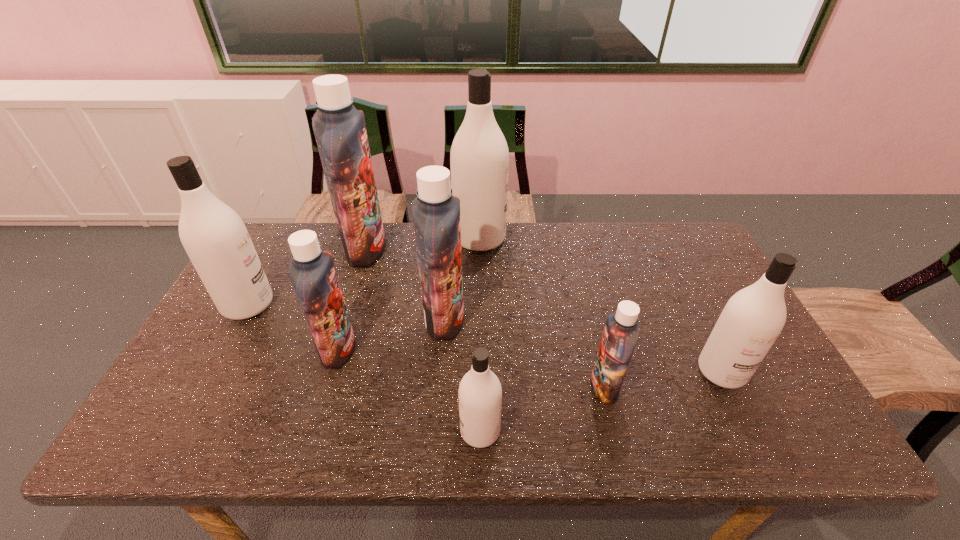
Where is `free space at the right edge`? The height and width of the screenshot is (540, 960). free space at the right edge is located at coordinates (708, 318).

You are a GUI agent. You are given a task and a screenshot of the screen. Output one action in this format:
    pyautogui.click(x=<x>, y=<y>)
    Task: Click on the blank space at the near right corner of the desktop
    This screenshot has height=540, width=960.
    Given the screenshot: What is the action you would take?
    pyautogui.click(x=748, y=420)

What are the coordinates of `empty space that is in between the leftmost object and the third biggest blue shampoo` in the screenshot? It's located at (293, 327).

In order to click on free space that is in between the third biggest white shampoo and the farthest blue shampoo in this screenshot , I will do `click(543, 310)`.

Find the location of a particular element. The height and width of the screenshot is (540, 960). vacant point located between the smallest blue shampoo and the farthest white shampoo is located at coordinates (542, 312).

At what (x,y) coordinates should I click in order to perform the action: click on empty location between the nearest object and the farthest white shampoo. Please return your answer as a coordinate pair (x, y). Image resolution: width=960 pixels, height=540 pixels. Looking at the image, I should click on (480, 335).

Locate an element on the screen. empty location between the nearest shampoo and the rightmost shampoo is located at coordinates (601, 401).

This screenshot has height=540, width=960. Identify the location of free space between the farthest blue shampoo and the nearest shampoo. (423, 340).

I want to click on unoccupied area between the leftmost object and the second smallest blue shampoo, so click(293, 327).

I want to click on vacant space in between the second blue shampoo from right to left and the third biggest white shampoo, so click(x=583, y=345).